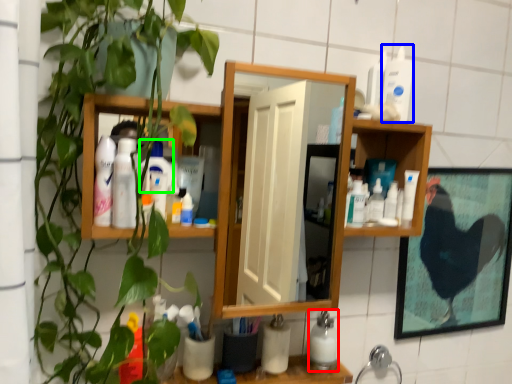
Question: Estimate the real-world distances between objects in this image. Which object is closer to cleaning product (highlighted by a red box), toiletry (highlighted by a blue box) or cleaning product (highlighted by a green box)?

Choices:
 (A) toiletry
 (B) cleaning product

Answer: (B)